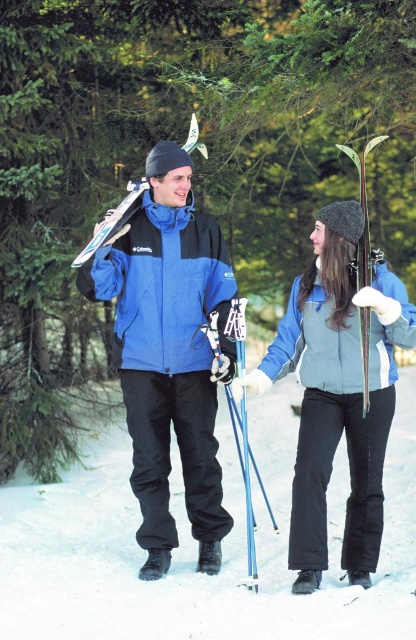
You are a photographer trying to capture a photo of the blue fabric jacket at center and the metallic blue ski pole at center. Based on their positions, which object is closer to the left side of the frame?

The blue fabric jacket at center is to the left of the metallic blue ski pole at center, so it is closer to the left side of the frame.

You are a photographer planning to take a group photo of the two people in the scene. You want to ensure that both the blue matte ski jacket at center and the blue fabric jacket at center are fully visible in the photo. Which jacket should be positioned closer to the front to avoid the other jacket being partially hidden?

The blue matte ski jacket at center is shorter than the blue fabric jacket at center. To ensure both jackets are fully visible, the shorter blue matte ski jacket at center should be positioned closer to the front so that the taller blue fabric jacket at center doesn not block it.